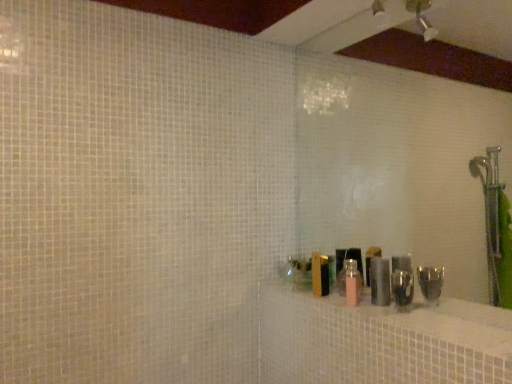
I want to click on free space in front of pink matte bottle at center, which is the 1th toiletry from left to right, so click(x=387, y=312).